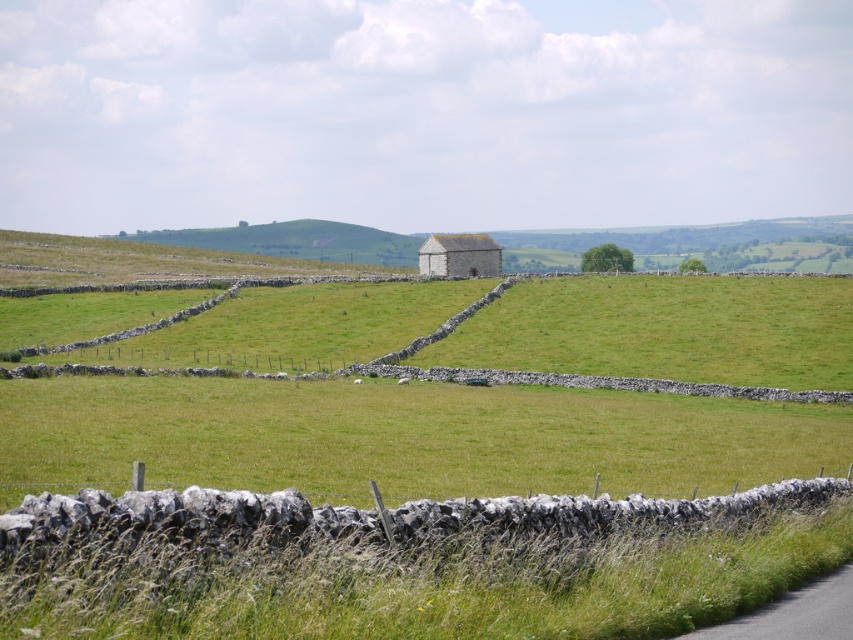
Question: Which point appears farthest from the camera in this image?

Choices:
 (A) (461, 234)
 (B) (508, 358)

Answer: (A)

Question: Observing the image, what is the correct spatial positioning of green grass at center in reference to white stone barn at center?

Choices:
 (A) above
 (B) below

Answer: (B)

Question: Is green grass at center below white stone barn at center?

Choices:
 (A) yes
 (B) no

Answer: (A)

Question: Which point appears closest to the camera in this image?

Choices:
 (A) (107, 477)
 (B) (448, 268)

Answer: (A)

Question: Does green grass at center appear under white stone barn at center?

Choices:
 (A) no
 (B) yes

Answer: (B)